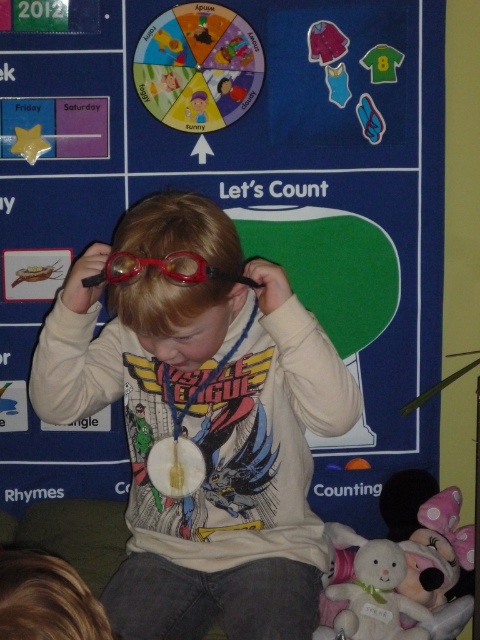
You are a teacher preparing a science experiment for students. You have two pairs of goggles available in the classroom. The matte plastic goggles at center and the translucent plastic goggles at center. Which pair of goggles would you choose if you need the larger one for the experiment?

The matte plastic goggles at center is larger in size than the translucent plastic goggles at center, so you should choose the matte plastic goggles at center for the experiment.

You are a teacher observing a science experiment setup in the classroom. You see two pairs of goggles, the matte plastic goggles at center and the translucent plastic goggles at center. Which pair is located to the right of the other?

The matte plastic goggles at center is positioned on the right side of translucent plastic goggles at center.

You are a teacher who needs to place a ruler exactly halfway between the matte plastic goggles at center and the translucent plastic goggles at center. Where should you place the ruler?

The ruler should be placed exactly halfway between the matte plastic goggles at center and the translucent plastic goggles at center, which would be at 5.545 inches from either object since the total distance between them is 11.09 inches.